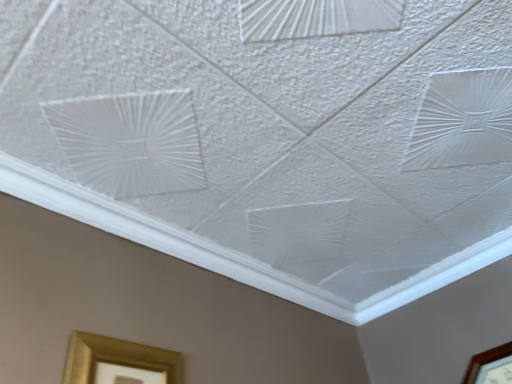
Question: Is brown wooden picture frame at lower right, the 2th picture frame when ordered from left to right, positioned before gold metallic picture frame at lower left, marked as the 1th picture frame in a left-to-right arrangement?

Choices:
 (A) yes
 (B) no

Answer: (B)

Question: Does brown wooden picture frame at lower right, acting as the first picture frame starting from the right, appear on the left side of gold metallic picture frame at lower left, which is counted as the second picture frame, starting from the back?

Choices:
 (A) yes
 (B) no

Answer: (B)

Question: Does brown wooden picture frame at lower right, the 2th picture frame when ordered from left to right, have a larger size compared to gold metallic picture frame at lower left, marked as the 1th picture frame in a left-to-right arrangement?

Choices:
 (A) no
 (B) yes

Answer: (B)

Question: Is the surface of brown wooden picture frame at lower right, the 2th picture frame when ordered from left to right, in direct contact with gold metallic picture frame at lower left, positioned as the 1th picture frame in front-to-back order?

Choices:
 (A) no
 (B) yes

Answer: (A)

Question: From a real-world perspective, is brown wooden picture frame at lower right, the second picture frame in the front-to-back sequence, positioned over gold metallic picture frame at lower left, which is counted as the second picture frame, starting from the back, based on gravity?

Choices:
 (A) no
 (B) yes

Answer: (B)

Question: Considering the relative sizes of brown wooden picture frame at lower right, the 2th picture frame when ordered from left to right, and gold metallic picture frame at lower left, placed as the second picture frame when sorted from right to left, in the image provided, is brown wooden picture frame at lower right, the 2th picture frame when ordered from left to right, smaller than gold metallic picture frame at lower left, placed as the second picture frame when sorted from right to left,?

Choices:
 (A) no
 (B) yes

Answer: (A)

Question: Is gold metallic picture frame at lower left, which is counted as the second picture frame, starting from the back, not inside brown wooden picture frame at lower right, the second picture frame in the front-to-back sequence?

Choices:
 (A) no
 (B) yes

Answer: (B)

Question: Could brown wooden picture frame at lower right, the 2th picture frame when ordered from left to right, be considered to be inside gold metallic picture frame at lower left, placed as the second picture frame when sorted from right to left?

Choices:
 (A) yes
 (B) no

Answer: (B)

Question: Is gold metallic picture frame at lower left, placed as the second picture frame when sorted from right to left, positioned in front of brown wooden picture frame at lower right, the 2th picture frame when ordered from left to right?

Choices:
 (A) no
 (B) yes

Answer: (B)

Question: From a real-world perspective, does gold metallic picture frame at lower left, positioned as the 1th picture frame in front-to-back order, sit lower than brown wooden picture frame at lower right, acting as the first picture frame starting from the right?

Choices:
 (A) yes
 (B) no

Answer: (A)

Question: Can you confirm if gold metallic picture frame at lower left, positioned as the 1th picture frame in front-to-back order, is positioned to the left of brown wooden picture frame at lower right, the second picture frame in the front-to-back sequence?

Choices:
 (A) no
 (B) yes

Answer: (B)

Question: Is brown wooden picture frame at lower right, the second picture frame in the front-to-back sequence, at the back of gold metallic picture frame at lower left, marked as the 1th picture frame in a left-to-right arrangement?

Choices:
 (A) no
 (B) yes

Answer: (A)

Question: Is point (507, 342) closer or farther from the camera than point (88, 362)?

Choices:
 (A) closer
 (B) farther

Answer: (B)